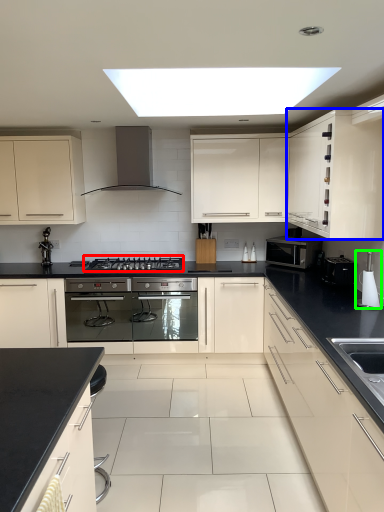
Question: Which object is the closest to the gas stove (highlighted by a red box)? Choose among these: cabinetry (highlighted by a blue box) or appliance (highlighted by a green box).

Choices:
 (A) cabinetry
 (B) appliance

Answer: (A)